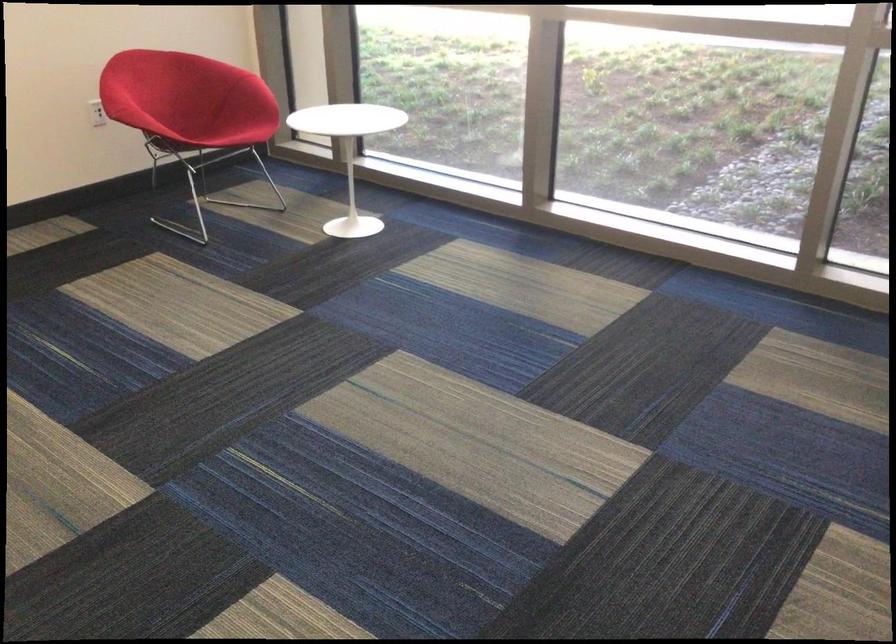
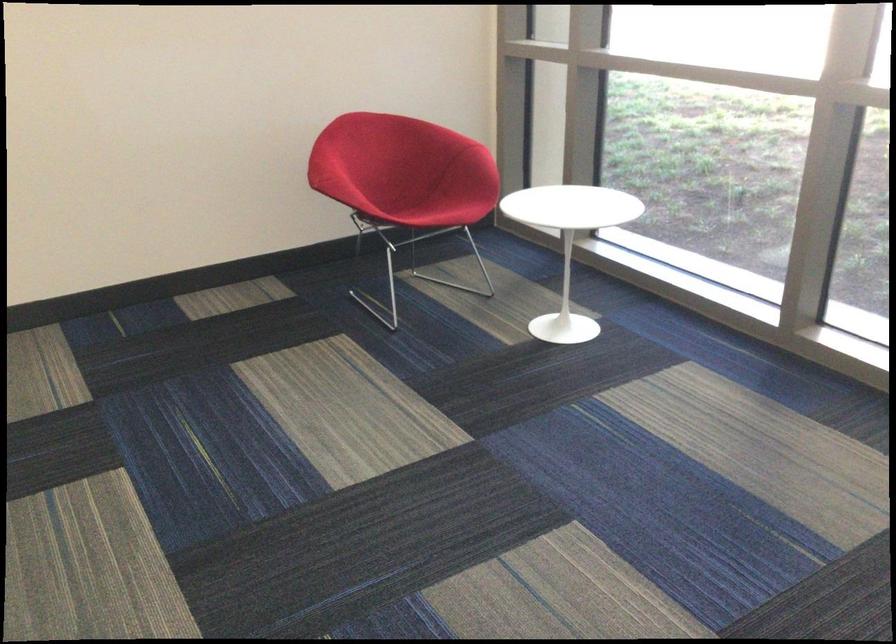
Where in the second image is the point corresponding to pixel 190 126 from the first image?

(403, 194)